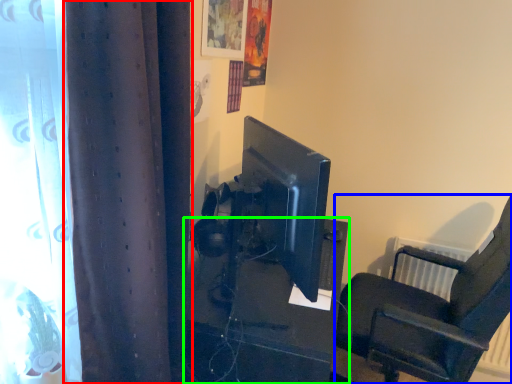
Question: Considering the real-world distances, which object is closest to curtain (highlighted by a red box)? chair (highlighted by a blue box) or furniture (highlighted by a green box).

Choices:
 (A) chair
 (B) furniture

Answer: (B)